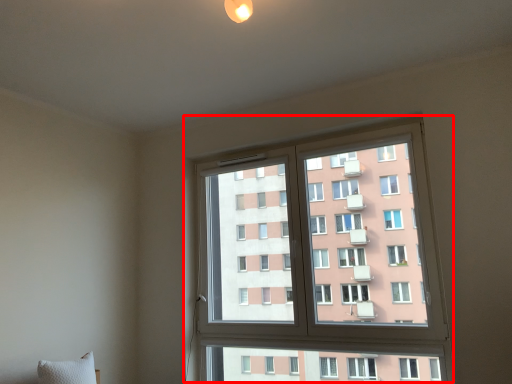
Question: Considering the relative positions of window (annotated by the red box) and pillow in the image provided, where is window (annotated by the red box) located with respect to the staircase?

Choices:
 (A) right
 (B) left

Answer: (A)